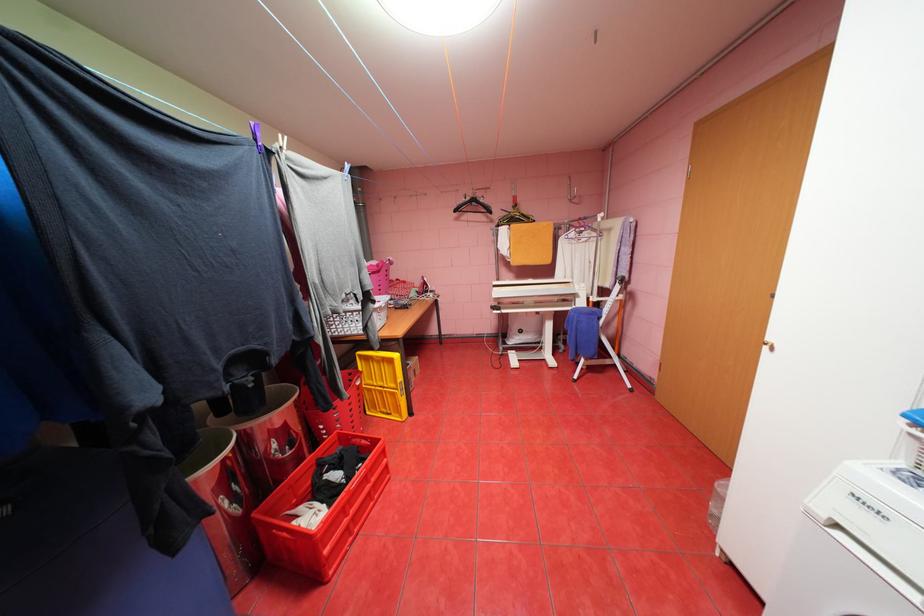
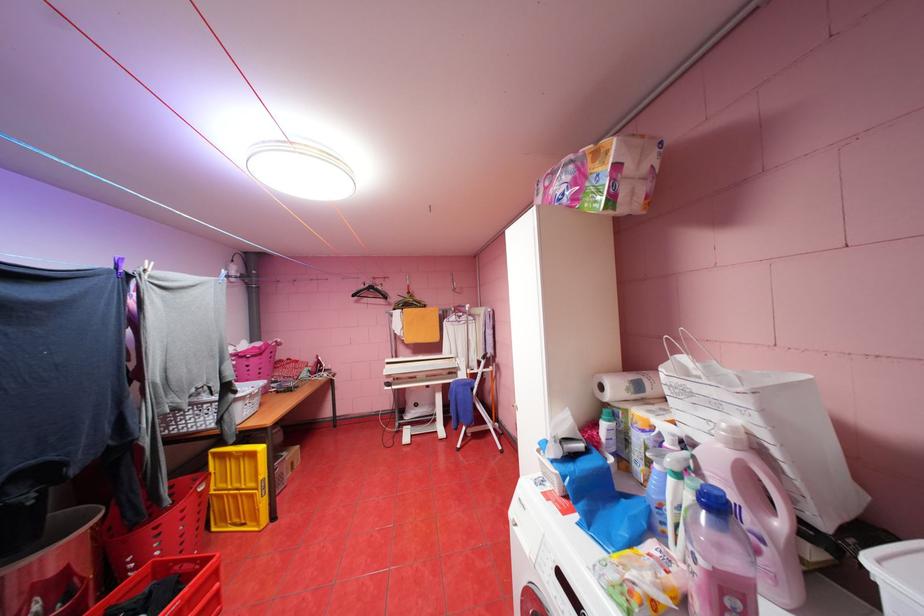
Find the pixel in the second image that matches pixel 464 209 in the first image.

(361, 294)